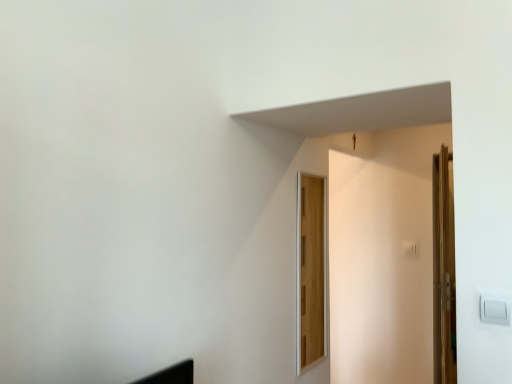
Question: Which direction should I rotate to look at wooden door at center, acting as the first door starting from the left, — up or down?

Choices:
 (A) down
 (B) up

Answer: (A)

Question: Is wooden door at right, which ranks as the 2th door in left-to-right order, to the right of wooden door at center, which appears as the second door when viewed from the back, from the viewer's perspective?

Choices:
 (A) yes
 (B) no

Answer: (A)

Question: Can you confirm if wooden door at right, the first door from the right, is wider than wooden door at center, which is the first door in front-to-back order?

Choices:
 (A) no
 (B) yes

Answer: (B)

Question: Is wooden door at center, which appears as the second door when viewed from the back, surrounded by wooden door at right, which appears as the first door when viewed from the back?

Choices:
 (A) yes
 (B) no

Answer: (B)

Question: Is wooden door at right, which appears as the first door when viewed from the back, turned away from wooden door at center, acting as the first door starting from the left?

Choices:
 (A) yes
 (B) no

Answer: (B)

Question: Could you tell me if wooden door at right, which is the second door from front to back, is facing wooden door at center, which appears as the 2th door when viewed from the right?

Choices:
 (A) no
 (B) yes

Answer: (A)

Question: Are wooden door at right, the first door from the right, and wooden door at center, acting as the first door starting from the left, far apart?

Choices:
 (A) yes
 (B) no

Answer: (A)

Question: Considering the relative sizes of wooden door at center, which appears as the second door when viewed from the back, and wooden door at right, the first door from the right, in the image provided, is wooden door at center, which appears as the second door when viewed from the back, wider than wooden door at right, the first door from the right,?

Choices:
 (A) no
 (B) yes

Answer: (A)

Question: Is wooden door at center, which appears as the second door when viewed from the back, smaller than wooden door at right, which ranks as the 2th door in left-to-right order?

Choices:
 (A) no
 (B) yes

Answer: (B)

Question: Considering the relative sizes of wooden door at center, which appears as the second door when viewed from the back, and wooden door at right, which is the second door from front to back, in the image provided, is wooden door at center, which appears as the second door when viewed from the back, taller than wooden door at right, which is the second door from front to back,?

Choices:
 (A) no
 (B) yes

Answer: (A)

Question: Is wooden door at center, which appears as the second door when viewed from the back, shorter than wooden door at right, the first door from the right?

Choices:
 (A) yes
 (B) no

Answer: (A)

Question: Does wooden door at center, which appears as the 2th door when viewed from the right, have a larger size compared to wooden door at right, the first door from the right?

Choices:
 (A) yes
 (B) no

Answer: (B)

Question: From a real-world perspective, is wooden door at center, which appears as the 2th door when viewed from the right, positioned under wooden door at right, which appears as the first door when viewed from the back, based on gravity?

Choices:
 (A) yes
 (B) no

Answer: (B)

Question: In the image, is wooden door at right, which appears as the first door when viewed from the back, positioned in front of or behind wooden door at center, acting as the first door starting from the left?

Choices:
 (A) behind
 (B) front

Answer: (A)